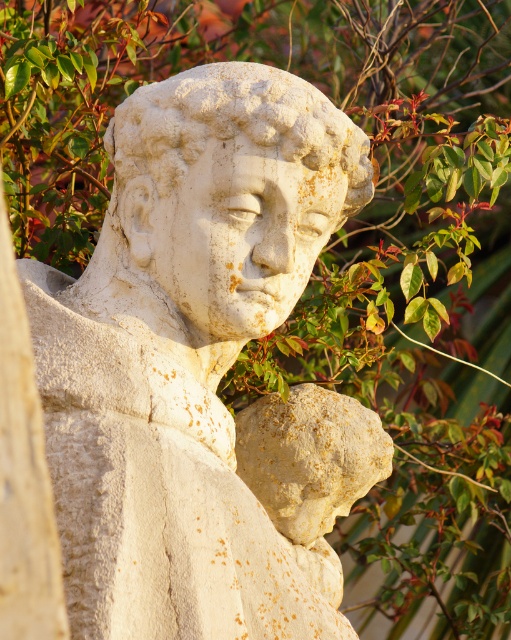
In the scene shown: You are standing in front of a sculpture garden and see the white stone statue at center. If you were to walk directly towards the statue, which direction should you move relative to your current position?

Since the white stone statue at center is located at point (187, 355), you should move forward towards the center of the garden to reach it.

You are an archaeologist examining the sculpture. You notice a point marked at coordinates (234, 125). What does this point correspond to on the sculpture?

The point at coordinates (234, 125) corresponds to the white stone head at center.

You are an art conservator examining the white stone statue at center and the white stone head at center. Which one is closer to you?

The white stone statue at center is closer to you than the white stone head at center.